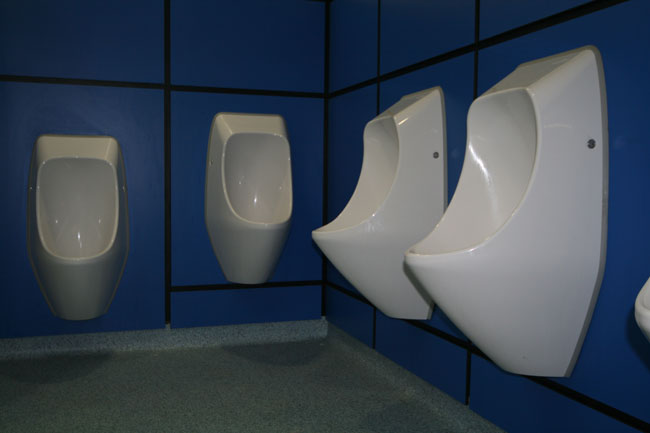
Where is `inside of urinal`? inside of urinal is located at coordinates (77, 242), (250, 197), (357, 202), (459, 225), (647, 303).